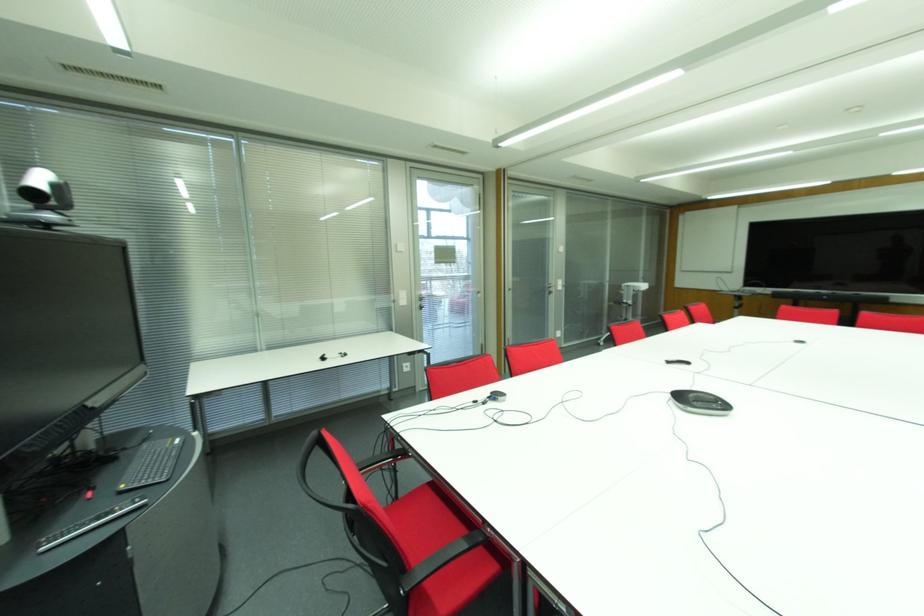
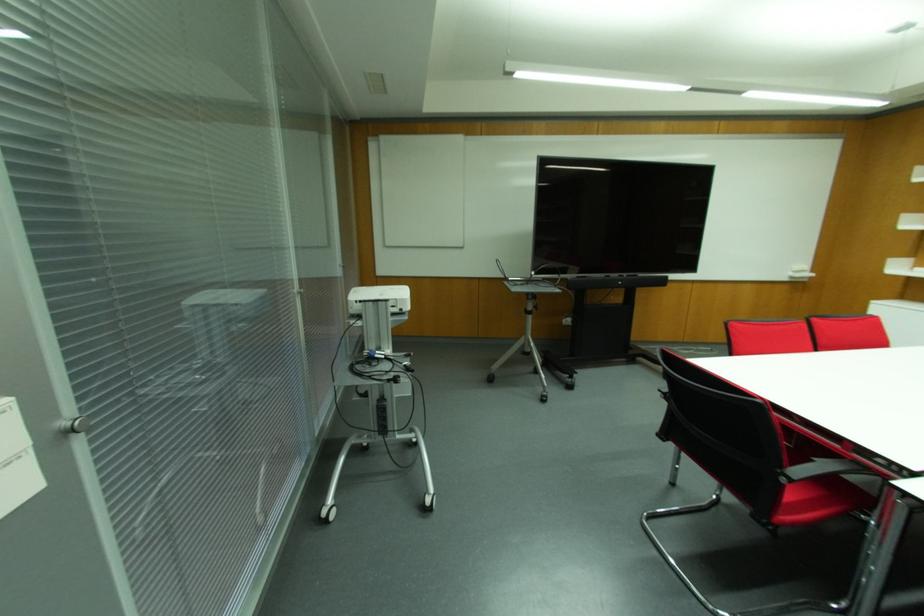
Locate, in the second image, the point that corresponds to the point at 642,286 in the first image.

(399, 294)